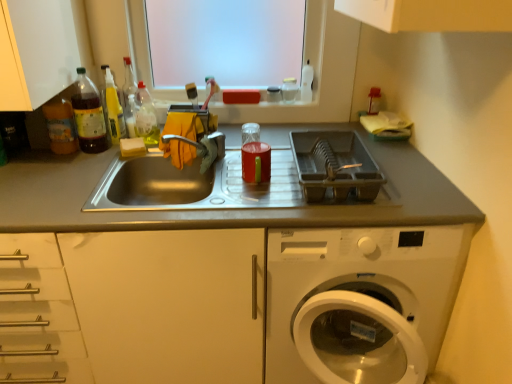
Find the location of a particular element. free spot behind plastic dish rack at right is located at coordinates (314, 132).